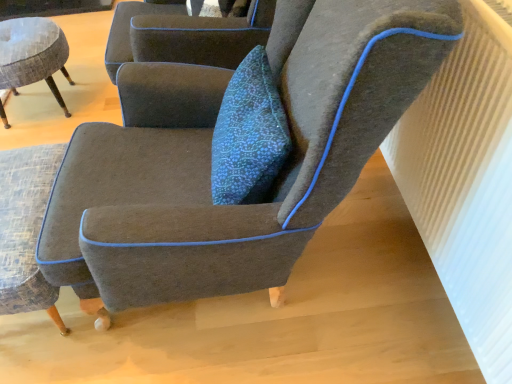
The height and width of the screenshot is (384, 512). In order to click on vacant region under white ribbed radiator at upper right (from a real-world perspective) in this screenshot , I will do `click(423, 283)`.